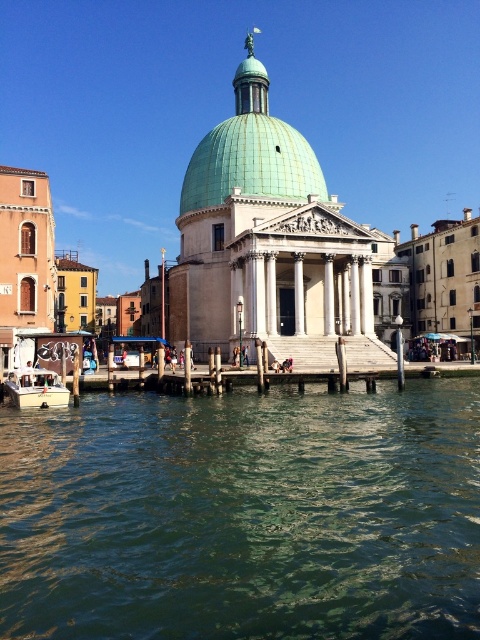
You are a tour guide leading a group on a gondola ride. You see the green glazed dome at center and the white plastic boat at lower left. Your gondola is 10 feet long. Can you safely navigate between them without hitting either?

The distance between the green glazed dome at center and the white plastic boat at lower left is 136.71 feet. Since your gondola is only 10 feet long, there is sufficient space to navigate safely between them.

You are standing on the wooden pier near the historic building. You want to estimate how far the green glazed dome at center is from your current position. What is the approximate distance in meters?

The green glazed dome at center is approximately 84.17 meters away from the viewer, so the distance is about 84.17 meters.

You are a tourist standing on the pier near the historic building. You want to take a photo of the white plastic boat at lower left without the greenish water at center in the foreground. Is this possible?

The greenish water at center is closer to the viewer than the white plastic boat at lower left, so it would block the view of the boat in the foreground. Therefore, it might not be possible to take a photo of the white plastic boat at lower left without the greenish water at center in the foreground.